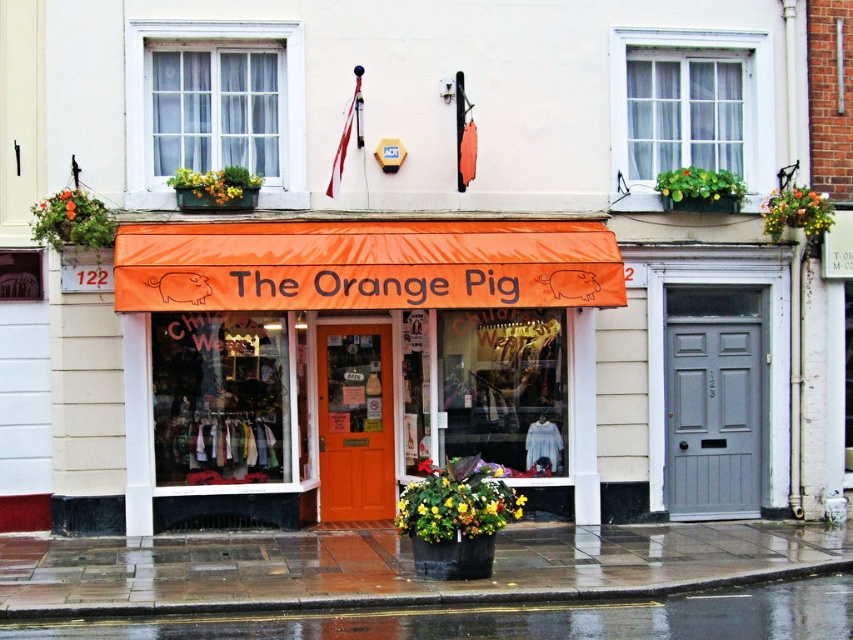
In the scene shown: Can you confirm if orange fabric awning at center is thinner than wet asphalt at lower left?

Yes.

Identify the location of orange fabric awning at center. (366, 266).

Which of these two, wet concrete pavement at lower center or wet asphalt at lower left, stands taller?

wet asphalt at lower left is taller.

Does wet concrete pavement at lower center appear on the left side of wet asphalt at lower left?

Indeed, wet concrete pavement at lower center is positioned on the left side of wet asphalt at lower left.

Who is more forward, (51, 611) or (726, 600)?

Positioned in front is point (51, 611).

The width and height of the screenshot is (853, 640). Find the location of `wet concrete pavement at lower center`. wet concrete pavement at lower center is located at coordinates (398, 566).

Who is higher up, orange fabric awning at center or white glass window at upper center?

Positioned higher is white glass window at upper center.

Is point (407, 228) farther from viewer compared to point (271, 124)?

No, it is in front of (271, 124).

Where is `orange fabric awning at center`? This screenshot has height=640, width=853. orange fabric awning at center is located at coordinates pos(366,266).